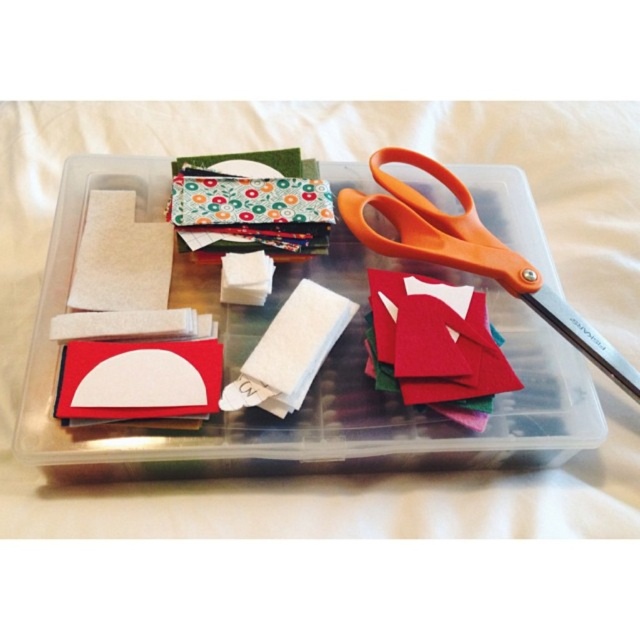
Does translucent plastic container at center have a larger size compared to orange plastic scissors at upper right?

Indeed, translucent plastic container at center has a larger size compared to orange plastic scissors at upper right.

Can you confirm if translucent plastic container at center is positioned below orange plastic scissors at upper right?

Indeed, translucent plastic container at center is positioned under orange plastic scissors at upper right.

Where is `translucent plastic container at center`? This screenshot has height=640, width=640. translucent plastic container at center is located at coordinates (314, 381).

Locate an element on the screen. Image resolution: width=640 pixels, height=640 pixels. translucent plastic container at center is located at coordinates (314, 381).